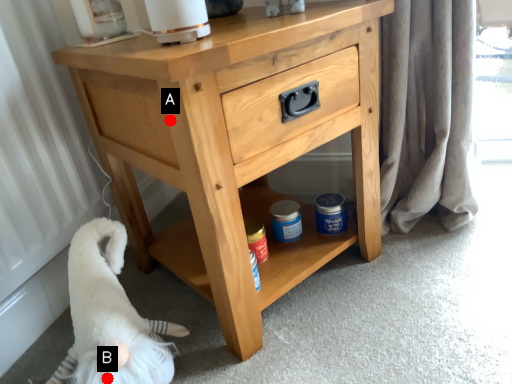
Question: Two points are circled on the image, labeled by A and B beside each circle. Which point appears farthest from the camera in this image?

Choices:
 (A) A is further
 (B) B is further

Answer: (B)